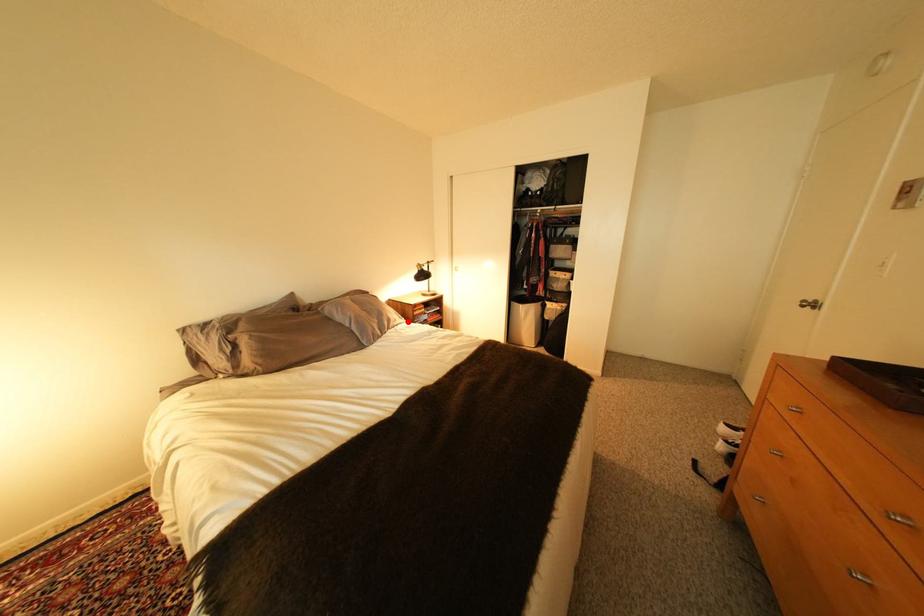
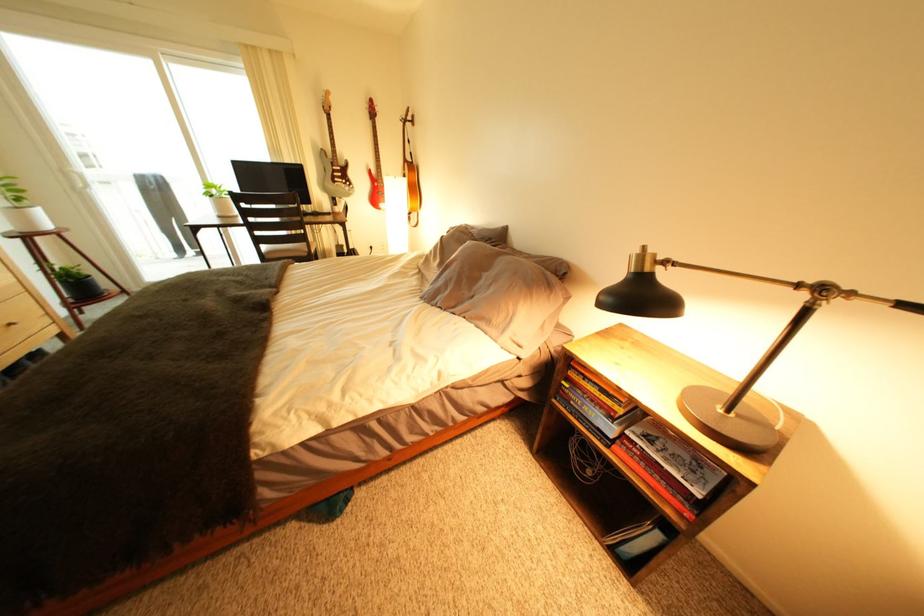
Question: I am providing you with two images of the same scene from different viewpoints. Given a red point in image1, look at the same physical point in image2. Is it:

Choices:
 (A) Closer to the viewpoint
 (B) Farther from the viewpoint

Answer: (B)